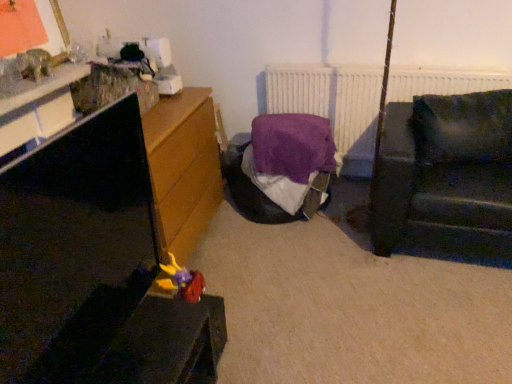
Question: Should I look upward or downward to see plush yellow and purple toy at lower left?

Choices:
 (A) down
 (B) up

Answer: (A)

Question: Should I look upward or downward to see white matte radiator at upper center?

Choices:
 (A) up
 (B) down

Answer: (A)

Question: Is white matte radiator at upper center smaller than matt black tv stand at left?

Choices:
 (A) no
 (B) yes

Answer: (A)

Question: Can you confirm if white matte radiator at upper center is thinner than matt black tv stand at left?

Choices:
 (A) yes
 (B) no

Answer: (B)

Question: Is white matte radiator at upper center to the left of matt black tv stand at left from the viewer's perspective?

Choices:
 (A) no
 (B) yes

Answer: (A)

Question: Considering the relative sizes of white matte radiator at upper center and matt black tv stand at left in the image provided, is white matte radiator at upper center taller than matt black tv stand at left?

Choices:
 (A) no
 (B) yes

Answer: (A)

Question: Is white matte radiator at upper center completely or partially outside of matt black tv stand at left?

Choices:
 (A) yes
 (B) no

Answer: (A)

Question: Does white matte radiator at upper center have a larger size compared to matt black tv stand at left?

Choices:
 (A) yes
 (B) no

Answer: (A)

Question: Could you tell me if dark green fabric couch at right is facing matt black tv stand at left?

Choices:
 (A) no
 (B) yes

Answer: (A)

Question: Is the surface of dark green fabric couch at right in direct contact with matt black tv stand at left?

Choices:
 (A) no
 (B) yes

Answer: (A)

Question: Is dark green fabric couch at right turned away from matt black tv stand at left?

Choices:
 (A) yes
 (B) no

Answer: (B)

Question: Does dark green fabric couch at right come in front of matt black tv stand at left?

Choices:
 (A) no
 (B) yes

Answer: (A)

Question: Is the position of dark green fabric couch at right more distant than that of matt black tv stand at left?

Choices:
 (A) yes
 (B) no

Answer: (A)

Question: Is dark green fabric couch at right not inside matt black tv stand at left?

Choices:
 (A) no
 (B) yes

Answer: (B)

Question: From a real-world perspective, is matt black tv stand at left on top of white matte radiator at upper center?

Choices:
 (A) no
 (B) yes

Answer: (B)